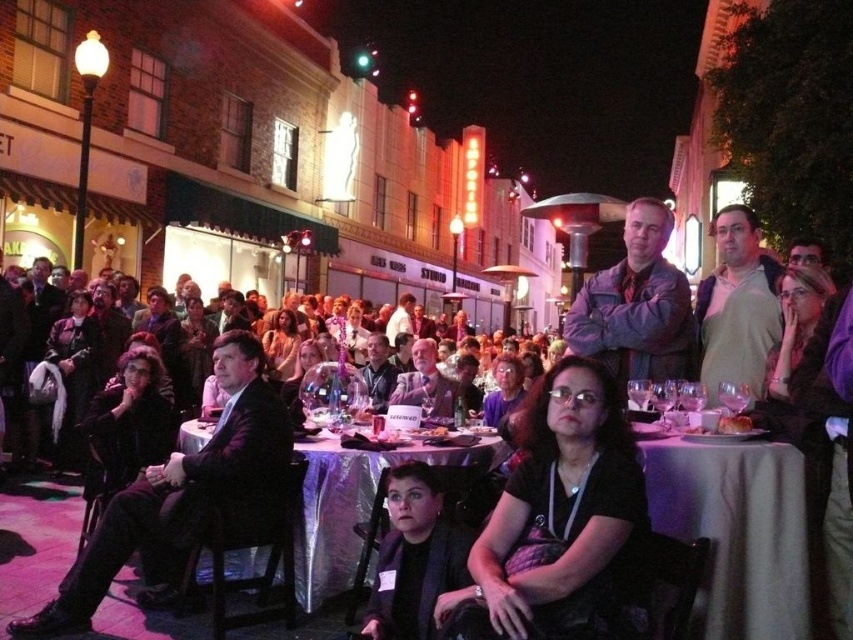
In the scene shown: You are at the nighttime event and want to move from point A to point B. Point A is at coordinate point point [410,588] and point B is at coordinate point [453,333]. Since you can only move forward, will you be able to see point B from point A?

Point point [410,588] is closer to the viewer than point point [453,333]. Since you are at point A which is closer to you, point B is further away, so you will be able to see point B from point A as it is in front of you.

You are standing at the center of the street and want to walk towards the point marked as point (611, 506). However, there is an obstacle at point (144, 557). Will you encounter the obstacle before reaching your destination?

Since point (611, 506) is in front of point (144, 557), you will reach your destination before encountering the obstacle at point (144, 557).